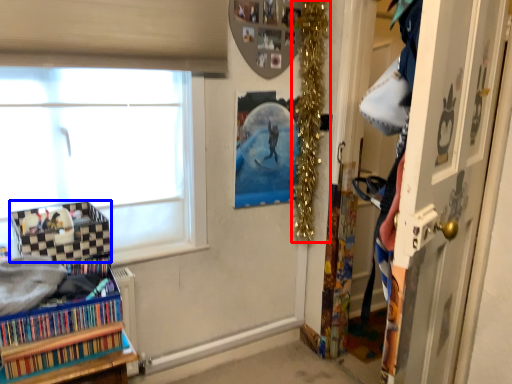
Question: Which object appears closest to the camera in this image, christmas decoration (highlighted by a red box) or shelf (highlighted by a blue box)?

Choices:
 (A) christmas decoration
 (B) shelf

Answer: (B)